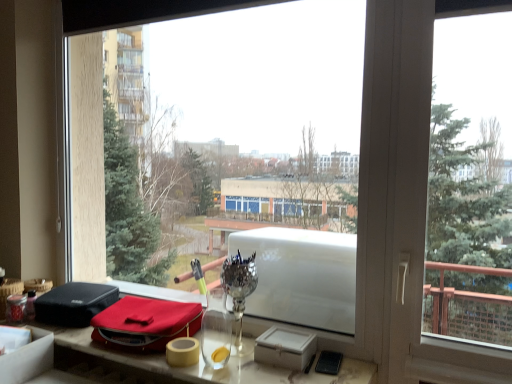
Question: Does velvet red pouch at lower left have a smaller size compared to matte red bag at lower center?

Choices:
 (A) yes
 (B) no

Answer: (A)

Question: Is velvet red pouch at lower left positioned far away from matte red bag at lower center?

Choices:
 (A) no
 (B) yes

Answer: (A)

Question: Is velvet red pouch at lower left to the left of matte red bag at lower center from the viewer's perspective?

Choices:
 (A) no
 (B) yes

Answer: (B)

Question: Can you confirm if velvet red pouch at lower left is bigger than matte red bag at lower center?

Choices:
 (A) yes
 (B) no

Answer: (B)

Question: Does velvet red pouch at lower left have a lesser height compared to matte red bag at lower center?

Choices:
 (A) yes
 (B) no

Answer: (B)

Question: From the image's perspective, is velvet red pouch at lower left on matte red bag at lower center?

Choices:
 (A) no
 (B) yes

Answer: (B)

Question: Can you confirm if matte red bag at lower center is thinner than velvet red pouch at lower left?

Choices:
 (A) no
 (B) yes

Answer: (A)

Question: Is the depth of matte red bag at lower center less than that of velvet red pouch at lower left?

Choices:
 (A) yes
 (B) no

Answer: (A)

Question: Is matte red bag at lower center facing away from velvet red pouch at lower left?

Choices:
 (A) yes
 (B) no

Answer: (B)

Question: Is matte red bag at lower center not close to velvet red pouch at lower left?

Choices:
 (A) no
 (B) yes

Answer: (A)

Question: From a real-world perspective, is matte red bag at lower center located beneath velvet red pouch at lower left?

Choices:
 (A) no
 (B) yes

Answer: (B)

Question: Considering the relative sizes of matte red bag at lower center and velvet red pouch at lower left in the image provided, is matte red bag at lower center smaller than velvet red pouch at lower left?

Choices:
 (A) yes
 (B) no

Answer: (B)

Question: In terms of width, does velvet red pouch at lower left look wider or thinner when compared to matte red bag at lower center?

Choices:
 (A) wide
 (B) thin

Answer: (B)